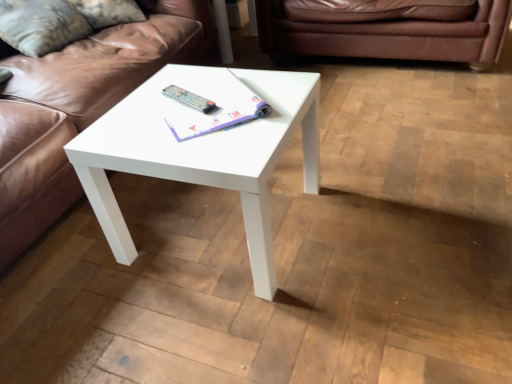
Identify the location of vacant location behind white paper book at center. (192, 78).